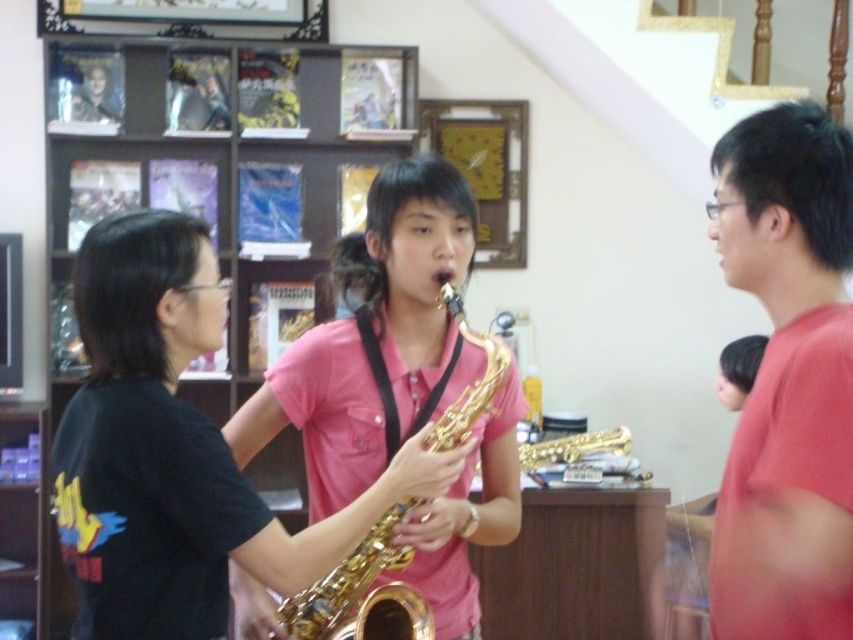
You are a customer in the music store and want to locate the gold shiny trumpet at center. According to the scene description, where is the gold shiny trumpet positioned relative to the other objects?

The gold shiny trumpet at center is located at point (347, 582), which places it centrally in the image.

Looking at this image, you are a photographer standing in front of the music store scene. You want to take a photo that includes both the gold shiny trumpet at center and the wooden frame at upper center. Which object should you focus on first to ensure both are in sharp focus?

You should focus on the gold shiny trumpet at center first because it is closer to the viewer than the wooden frame at upper center. By focusing on the closer object, the background object will still be in acceptable focus due to the depth of field.

You are standing in the music store and want to take a photo of the point at coordinates (769, 152). The camera you are using has a maximum focus range of 4 feet. Will the camera be able to focus on the point?

The point at coordinates (769, 152) is 3.86 feet away from the camera, which is within the camera maximum focus range of 4 feet. Therefore, the camera can focus on the point.